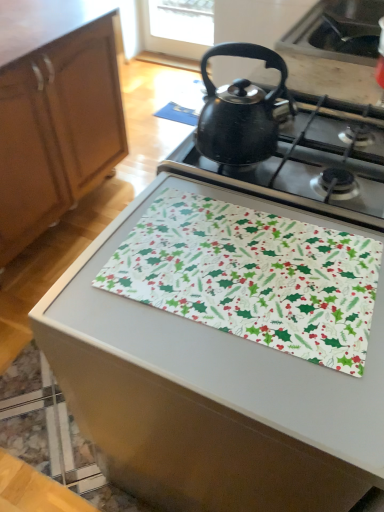
Where is `free point above white fabric placemat at center (from a real-world perspective)`? free point above white fabric placemat at center (from a real-world perspective) is located at coordinates (231, 280).